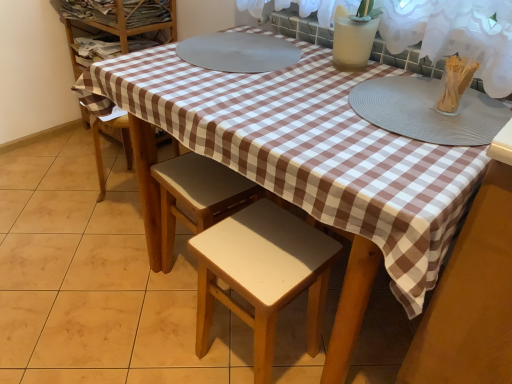
Find the location of `vacant space in front of light brown wood stool at center, which ranks as the 1th stool in back-to-front order`. vacant space in front of light brown wood stool at center, which ranks as the 1th stool in back-to-front order is located at coordinates (174, 335).